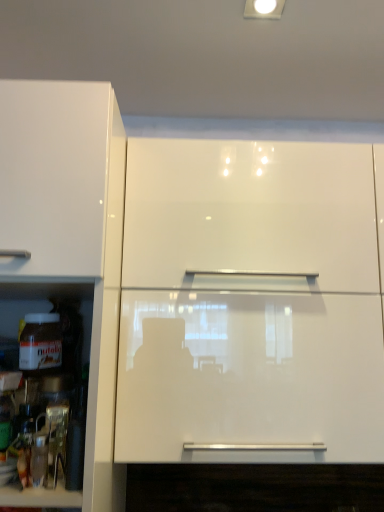
Question: Visually, is glossy white cabinet at upper center positioned to the left or to the right of white glossy cabinet at left?

Choices:
 (A) left
 (B) right

Answer: (B)

Question: From a real-world perspective, is glossy white cabinet at upper center above or below white glossy cabinet at left?

Choices:
 (A) above
 (B) below

Answer: (A)

Question: In terms of width, does glossy white cabinet at upper center look wider or thinner when compared to white glossy cabinet at left?

Choices:
 (A) thin
 (B) wide

Answer: (A)

Question: In terms of height, does white glossy cabinet at left look taller or shorter compared to glossy white cabinet at upper center?

Choices:
 (A) tall
 (B) short

Answer: (A)

Question: Which is correct: white glossy cabinet at left is inside glossy white cabinet at upper center, or outside of it?

Choices:
 (A) outside
 (B) inside

Answer: (A)

Question: Based on their sizes in the image, would you say white glossy cabinet at left is bigger or smaller than glossy white cabinet at upper center?

Choices:
 (A) big
 (B) small

Answer: (A)

Question: Relative to glossy white cabinet at upper center, is white glossy cabinet at left in front or behind?

Choices:
 (A) behind
 (B) front

Answer: (B)